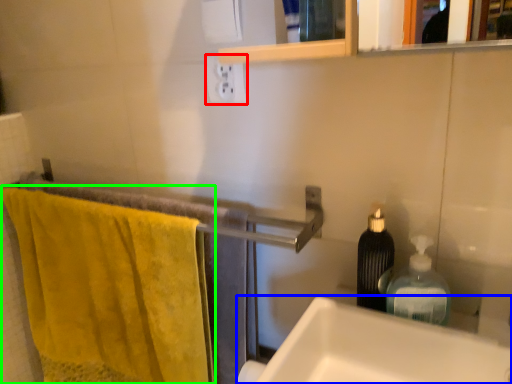
Question: Considering the real-world distances, which object is closest to electric outlet (highlighted by a red box)? sink (highlighted by a blue box) or bath towel (highlighted by a green box).

Choices:
 (A) sink
 (B) bath towel

Answer: (A)